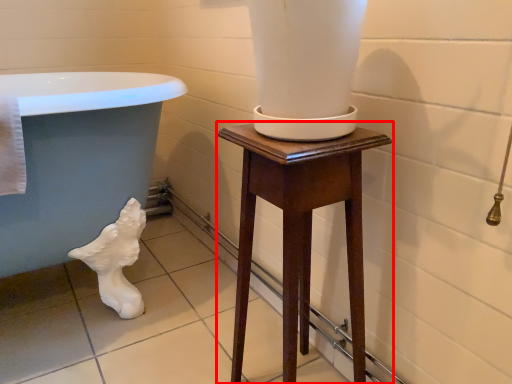
Question: Considering the relative positions of furniture (annotated by the red box) and bath in the image provided, where is furniture (annotated by the red box) located with respect to the staircase?

Choices:
 (A) left
 (B) right

Answer: (B)